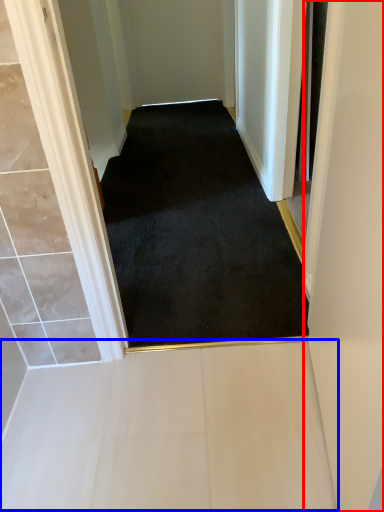
Question: Which of the following is the closest to the observer, door (highlighted by a red box) or path (highlighted by a blue box)?

Choices:
 (A) door
 (B) path

Answer: (A)